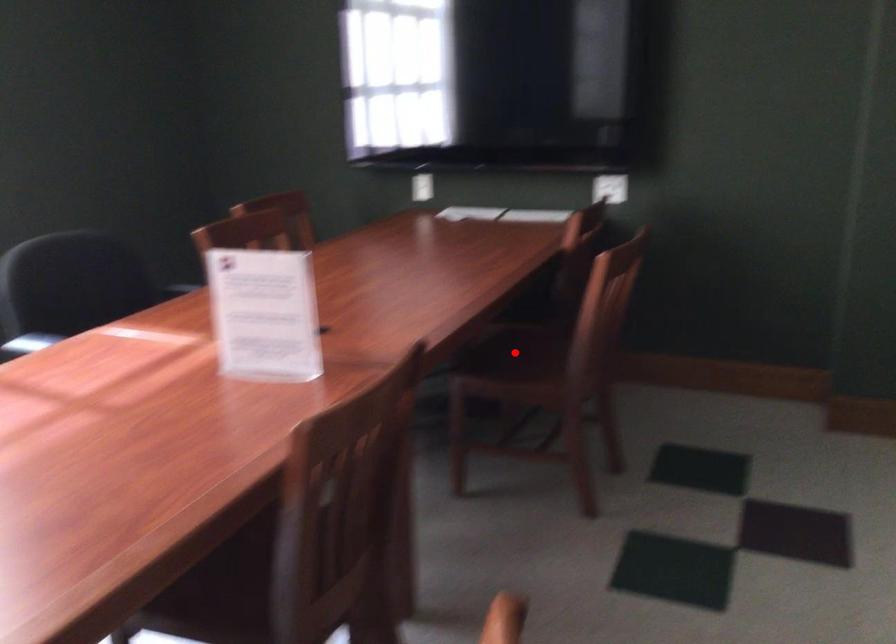
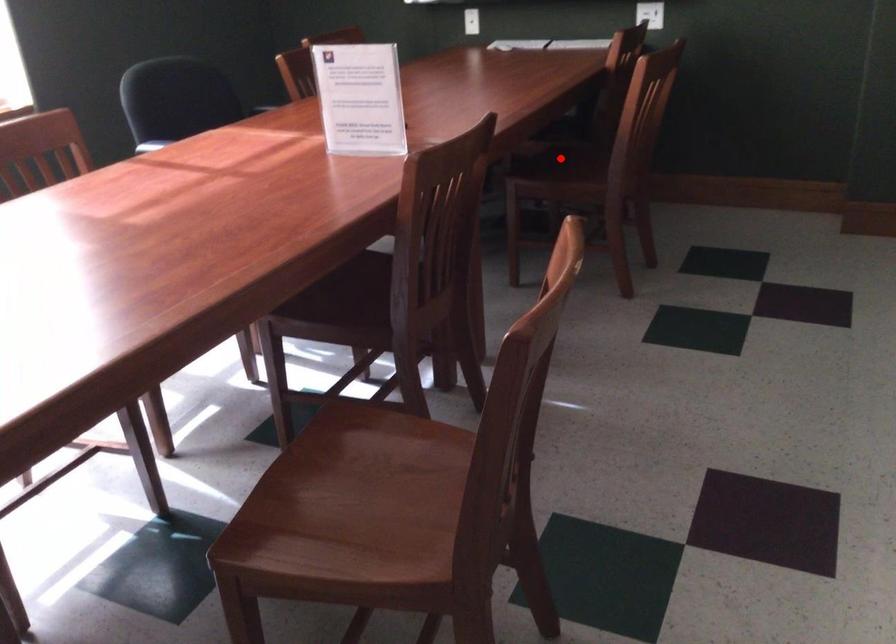
In the scene shown: I am providing you with two images of the same scene from different viewpoints. A red point is marked on the first image and another point is marked on the second image. Is the red point in image1 aligned with the point shown in image2?

Yes